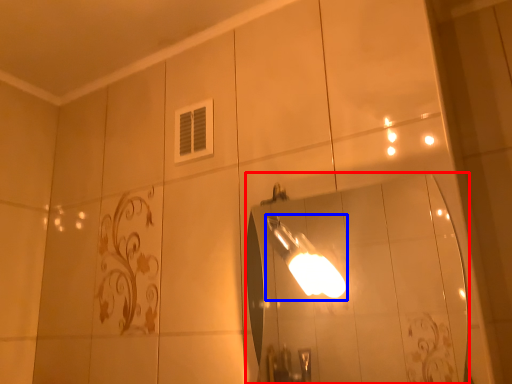
Question: Which point is further to the camera, mirror (highlighted by a red box) or light fixture (highlighted by a blue box)?

Choices:
 (A) mirror
 (B) light fixture

Answer: (B)